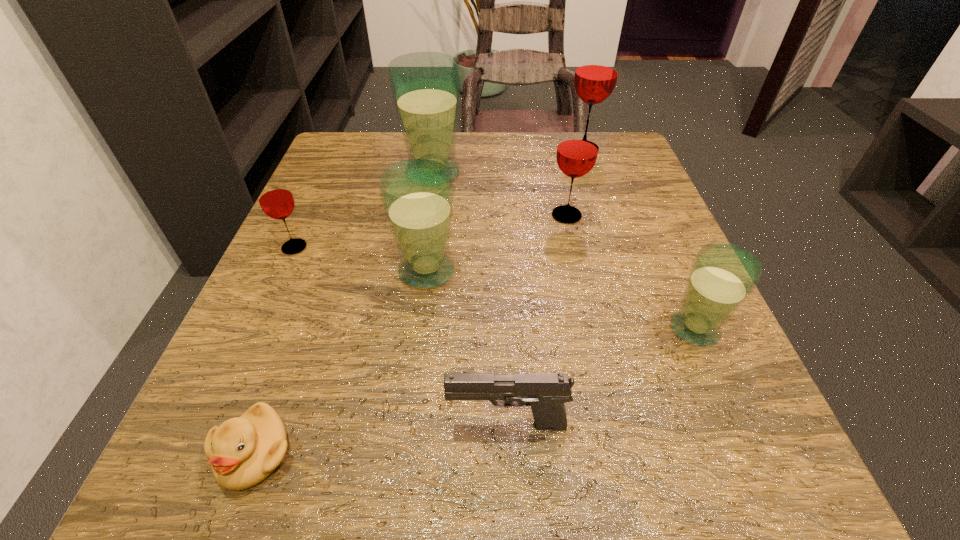
Where is `vacant space at the far left corner`? This screenshot has width=960, height=540. vacant space at the far left corner is located at coordinates (350, 181).

The width and height of the screenshot is (960, 540). In order to click on free region at the near left corner of the desktop in this screenshot , I will do `click(182, 468)`.

In the image, there is a desktop. Where is `free space at the far right corner`? free space at the far right corner is located at coordinates (636, 160).

Find the location of a particular element. The width and height of the screenshot is (960, 540). vacant area between the nearest glass and the smallest red glass is located at coordinates (494, 288).

You are a GUI agent. You are given a task and a screenshot of the screen. Output one action in this format:
    pyautogui.click(x=<x>, y=<y>)
    Task: Click on the free area in between the leftmost red glass and the seventh tallest object
    Image resolution: width=960 pixels, height=540 pixels.
    Given the screenshot: What is the action you would take?
    pyautogui.click(x=400, y=336)

Locate an element on the screen. empty space that is in between the pistol and the nearest glass is located at coordinates click(601, 377).

Locate an element on the screen. Image resolution: width=960 pixels, height=540 pixels. free point between the duckling and the sixth nearest object is located at coordinates (411, 334).

This screenshot has height=540, width=960. I want to click on vacant area between the pistol and the smallest blue glass, so click(601, 377).

I want to click on vacant space that is in between the farthest blue glass and the seventh tallest object, so click(x=470, y=299).

This screenshot has height=540, width=960. What are the coordinates of `empty location between the shortest object and the second smallest blue glass` in the screenshot? It's located at (341, 362).